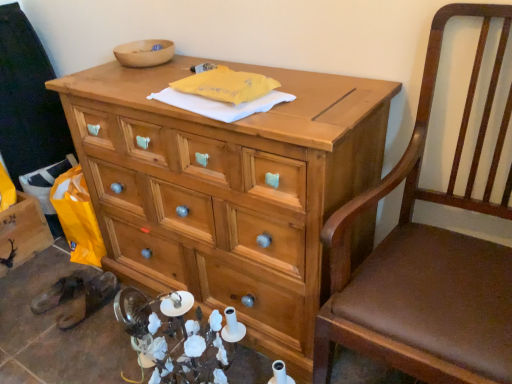
Question: Considering the relative sizes of brown leather sandals at lower left and brown leather chair at right in the image provided, is brown leather sandals at lower left smaller than brown leather chair at right?

Choices:
 (A) no
 (B) yes

Answer: (B)

Question: Is brown leather sandals at lower left touching brown leather chair at right?

Choices:
 (A) yes
 (B) no

Answer: (B)

Question: Is brown leather sandals at lower left facing away from brown leather chair at right?

Choices:
 (A) no
 (B) yes

Answer: (A)

Question: Does brown leather sandals at lower left have a larger size compared to brown leather chair at right?

Choices:
 (A) yes
 (B) no

Answer: (B)

Question: From the image's perspective, would you say brown leather sandals at lower left is positioned over brown leather chair at right?

Choices:
 (A) no
 (B) yes

Answer: (A)

Question: Is the position of brown leather sandals at lower left less distant than that of brown leather chair at right?

Choices:
 (A) no
 (B) yes

Answer: (A)

Question: Is there a large distance between natural wood desk at center and wooden crate at lower left?

Choices:
 (A) no
 (B) yes

Answer: (A)

Question: Can you confirm if natural wood desk at center is smaller than wooden crate at lower left?

Choices:
 (A) no
 (B) yes

Answer: (A)

Question: Considering the relative positions of natural wood desk at center and wooden crate at lower left in the image provided, is natural wood desk at center to the right of wooden crate at lower left from the viewer's perspective?

Choices:
 (A) yes
 (B) no

Answer: (A)

Question: Can you confirm if natural wood desk at center is bigger than wooden crate at lower left?

Choices:
 (A) no
 (B) yes

Answer: (B)

Question: Is natural wood desk at center to the left of wooden crate at lower left from the viewer's perspective?

Choices:
 (A) yes
 (B) no

Answer: (B)

Question: Is natural wood desk at center facing towards wooden crate at lower left?

Choices:
 (A) no
 (B) yes

Answer: (A)

Question: From the image's perspective, is natural wood desk at center beneath brown leather chair at right?

Choices:
 (A) yes
 (B) no

Answer: (B)